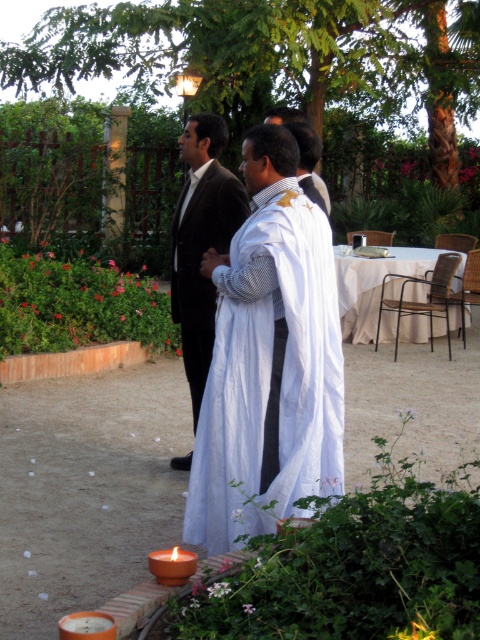
Who is taller, white cotton dress at center or matte orange candle at lower left?

With more height is white cotton dress at center.

Does white cotton dress at center have a greater width compared to matte orange candle at lower left?

Correct, the width of white cotton dress at center exceeds that of matte orange candle at lower left.

Between point (316, 230) and point (90, 616), which one is positioned behind?

The point (316, 230) is more distant.

The image size is (480, 640). What are the coordinates of `white cotton dress at center` in the screenshot? It's located at (268, 381).

Is point (233, 388) in front of point (176, 564)?

No, it is not.

Between white cotton dress at center and matte brown candle at lower left, which one appears on the left side from the viewer's perspective?

From the viewer's perspective, matte brown candle at lower left appears more on the left side.

Identify the location of white cotton dress at center. This screenshot has height=640, width=480. (268, 381).

Where is `white cotton dress at center`? white cotton dress at center is located at coordinates (268, 381).

Which is behind, point (326, 477) or point (225, 228)?

The point (225, 228) is behind.

Is point (267, 304) positioned after point (188, 346)?

That is False.

Identify the location of white cotton dress at center. (268, 381).